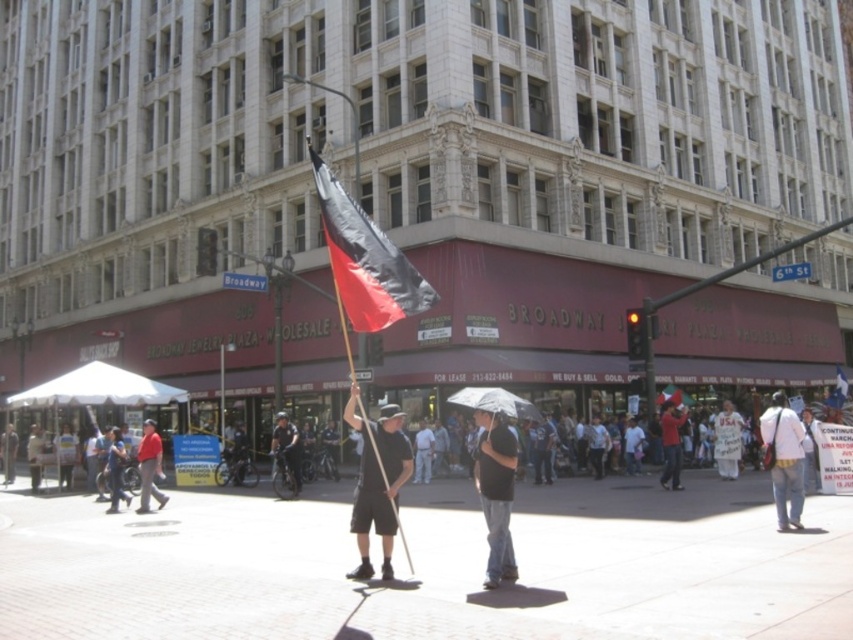
You are a pedestrian trying to cross the street at the busy downtown area shown. You see a black matte umbrella at center and a dark blue uniform at center. Which one is positioned to your right side?

The black matte umbrella at center is to the right of the dark blue uniform at center, so the black matte umbrella at center is positioned to your right side.

You are a city planner assessing the space between the black matte umbrella at center and the dark blue uniform at center. If you need to install a temporary walkway that must be at least 15 meters long, will the available space between them suffice?

The distance between the black matte umbrella at center and the dark blue uniform at center is 15.47 meters, which exceeds the required 15 meters. Therefore, the temporary walkway can be installed in the available space between them.